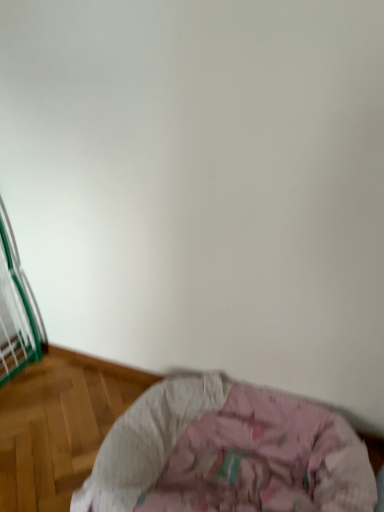
Image resolution: width=384 pixels, height=512 pixels. What do you see at coordinates (146, 440) in the screenshot?
I see `fluffy white bed at lower center` at bounding box center [146, 440].

You are a GUI agent. You are given a task and a screenshot of the screen. Output one action in this format:
    pyautogui.click(x=<x>, y=<y>)
    Task: Click on the fluffy white bed at lower center
    
    Given the screenshot: What is the action you would take?
    [146, 440]

Find the location of a particular element. fluffy white bed at lower center is located at coordinates (146, 440).